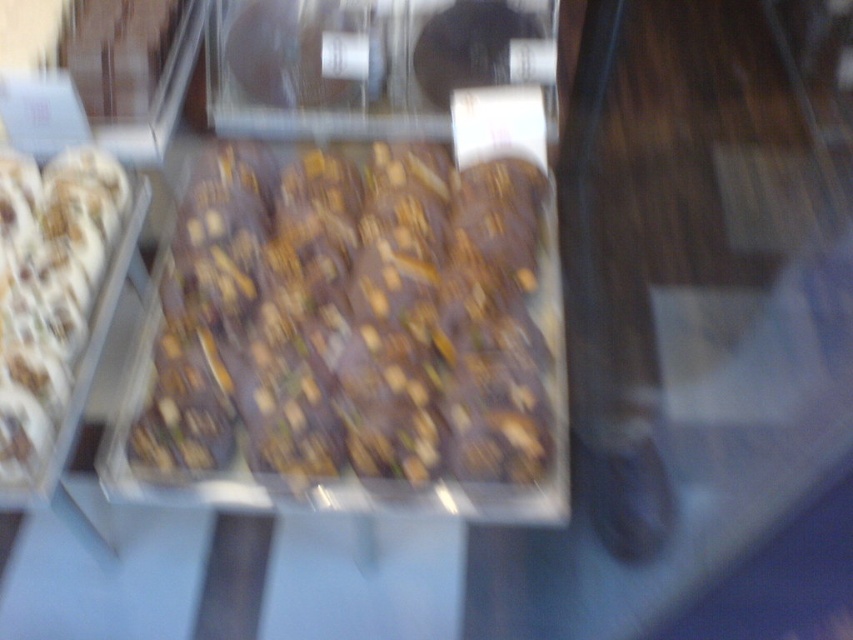
You are a customer at the bakery and want to choose between the dark chocolate bar at center and the white frosted donut at left. Based on their sizes, which one would you pick if you prefer a bigger treat?

The dark chocolate bar at center is larger in size compared to the white frosted donut at left, so you should pick the dark chocolate bar at center if you prefer a bigger treat.

You are a customer in a bakery and want to buy both the dark chocolate bar at center and the white frosted donut at left. The cashier asks you to point out their positions relative to each other. How would you describe their arrangement?

The dark chocolate bar at center is above the white frosted donut at left.